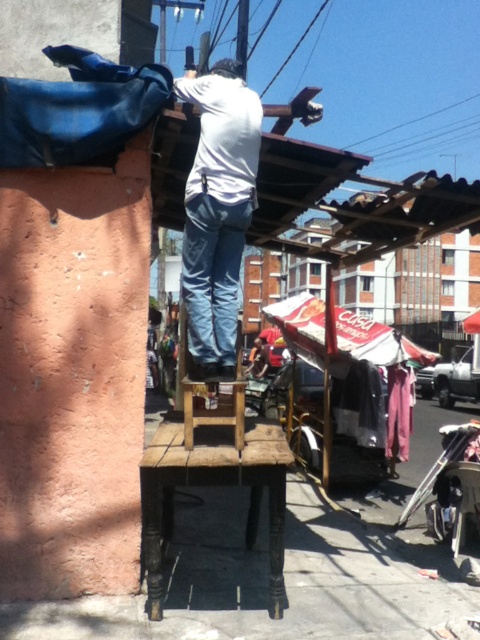
From the picture: Is white matte shirt at center closer to the viewer compared to wooden stool at center?

No, white matte shirt at center is behind wooden stool at center.

Who is positioned more to the left, white matte shirt at center or wooden stool at center?

Positioned to the left is wooden stool at center.

Describe the element at coordinates (217, 211) in the screenshot. The image size is (480, 640). I see `white matte shirt at center` at that location.

You are a GUI agent. You are given a task and a screenshot of the screen. Output one action in this format:
    pyautogui.click(x=<x>, y=<y>)
    Task: Click on the white matte shirt at center
    This screenshot has width=480, height=640.
    Given the screenshot: What is the action you would take?
    pyautogui.click(x=217, y=211)